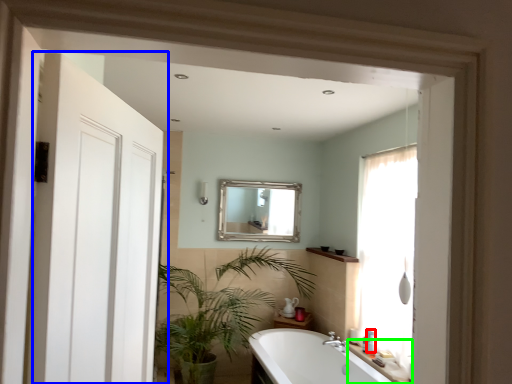
Question: Considering the real-world distances, which object is closest to toiletry (highlighted by a red box)? door (highlighted by a blue box) or counter top (highlighted by a green box).

Choices:
 (A) door
 (B) counter top

Answer: (B)